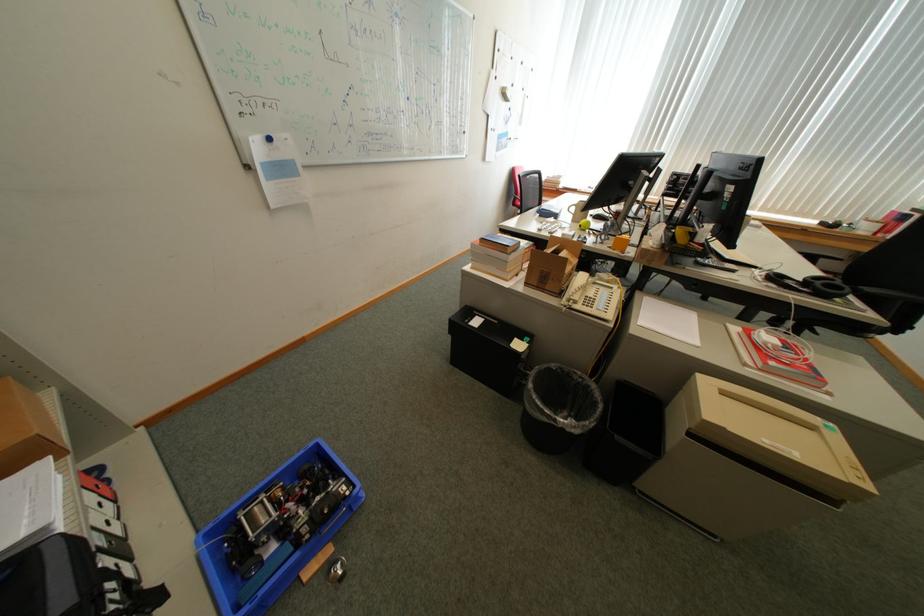
Find where to sit the chair sitting surface. Please return your answer as a coordinate pair (x, y).

(846, 300)